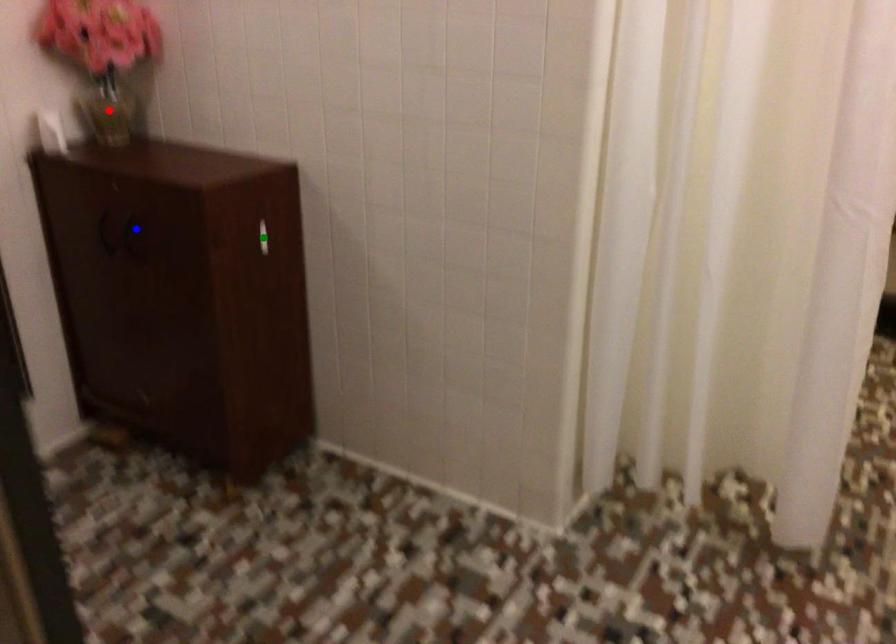
Order these from nearest to farthest:
A) green point
B) blue point
C) red point

1. blue point
2. green point
3. red point